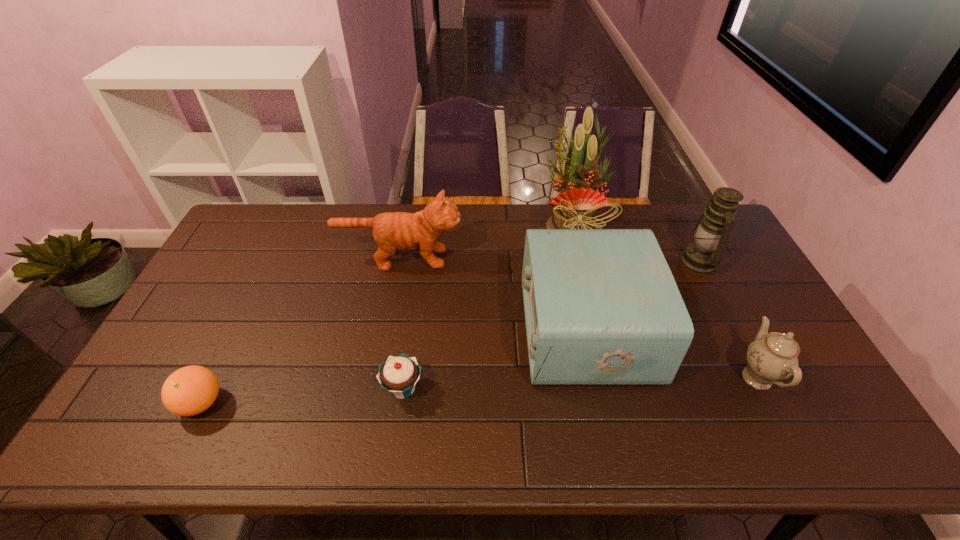
Locate an element on the screen. free space located on the front panel of the radio receiver is located at coordinates (458, 329).

What are the coordinates of `vacant region located 0.050m on the front panel of the radio receiver` in the screenshot? It's located at click(x=507, y=329).

Find the location of a particular element. The width and height of the screenshot is (960, 540). vacant space situated 0.240m on the front panel of the radio receiver is located at coordinates (441, 329).

You are a GUI agent. You are given a task and a screenshot of the screen. Output one action in this format:
    pyautogui.click(x=<x>, y=<y>)
    Task: Click on the free space located 0.290m on the spout of the chinaware
    
    Given the screenshot: What is the action you would take?
    click(625, 377)

You are a GUI agent. You are given a task and a screenshot of the screen. Output one action in this format:
    pyautogui.click(x=<x>, y=<y>)
    Task: Click on the vacant space located on the spout of the chinaware
    The image size is (960, 540).
    Given the screenshot: What is the action you would take?
    pyautogui.click(x=606, y=377)

Identify the location of free space located 0.140m on the spout of the chinaware. This screenshot has height=540, width=960. (683, 377).

Where is `vacant space located 0.160m on the right of the leftmost object`? This screenshot has height=540, width=960. vacant space located 0.160m on the right of the leftmost object is located at coordinates point(289,403).

The image size is (960, 540). In order to click on free space located on the back of the cupcake in this screenshot , I will do `click(418, 279)`.

Locate an element on the screen. flower arrangement that is at the far edge is located at coordinates (577, 204).

The width and height of the screenshot is (960, 540). Find the location of `oil lamp that is at the far edge`. oil lamp that is at the far edge is located at coordinates (710, 235).